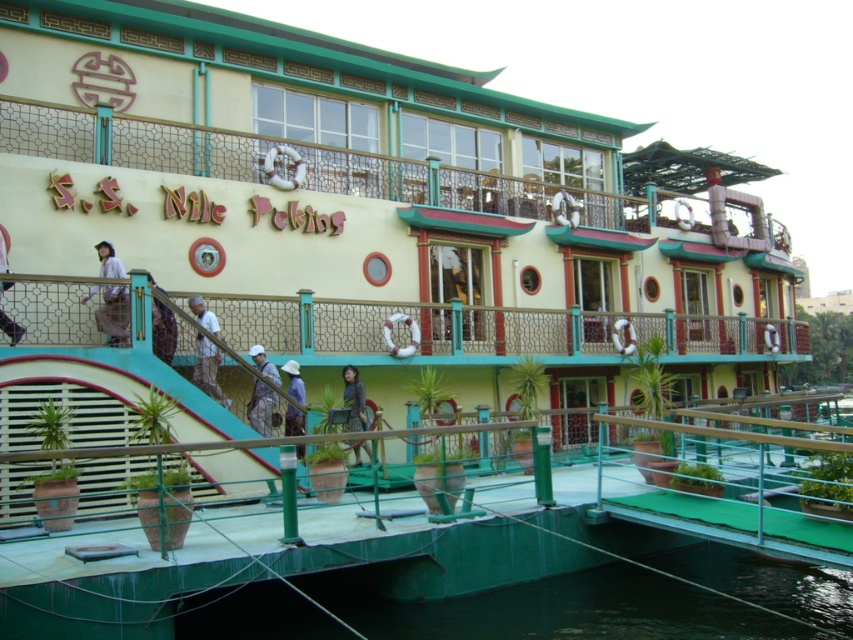
Find the location of a particular element. blue fabric hat at center is located at coordinates (294, 380).

Is blue fabric hat at center bigger than matte white helmet at lower left?

Yes, blue fabric hat at center is bigger than matte white helmet at lower left.

Measure the distance between blue fabric hat at center and camera.

blue fabric hat at center and camera are 73.30 feet apart from each other.

Locate an element on the screen. The image size is (853, 640). blue fabric hat at center is located at coordinates (294, 380).

Between point (126, 326) and point (291, 428), which one is positioned behind?

The point (291, 428) is behind.

Does point (106, 321) come in front of point (294, 416)?

Yes, point (106, 321) is closer to viewer.

In order to click on light brown fabric pants at center in this screenshot , I will do `click(111, 310)`.

Which is below, white hard hat at center or blue fabric hat at center?

white hard hat at center

What do you see at coordinates (260, 406) in the screenshot?
I see `white hard hat at center` at bounding box center [260, 406].

Is point (257, 392) positioned after point (300, 417)?

Yes, it is.

Identify the location of white hard hat at center. Image resolution: width=853 pixels, height=640 pixels. (260, 406).